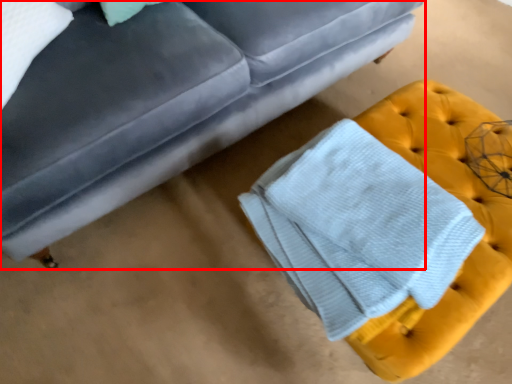
Question: From the image, what is the correct spatial relationship of studio couch (annotated by the red box) in relation to bath towel?

Choices:
 (A) right
 (B) left

Answer: (B)